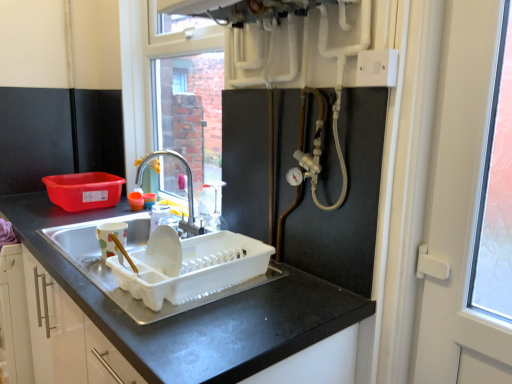
Identify the location of unoccupied region to the right of white plastic dish rack at sink, which is the second appliance in left-to-right order. (291, 300).